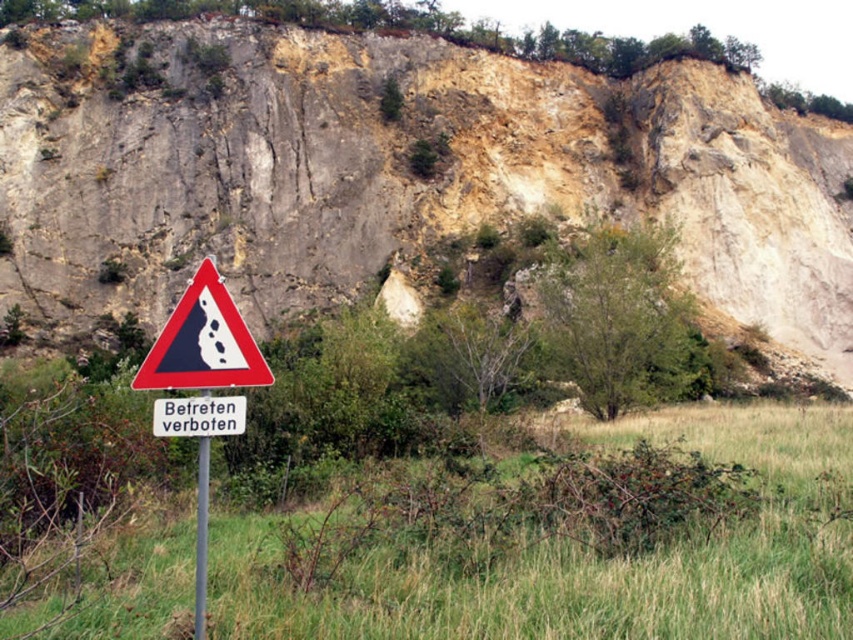
Does rough stone cliff at upper center have a lesser height compared to red triangle warning sign at lower left?

In fact, rough stone cliff at upper center may be taller than red triangle warning sign at lower left.

Between rough stone cliff at upper center and red triangle warning sign at lower left, which one appears on the left side from the viewer's perspective?

From the viewer's perspective, red triangle warning sign at lower left appears more on the left side.

Does point (813, 349) lie behind point (238, 317)?

Yes, it is behind point (238, 317).

I want to click on rough stone cliff at upper center, so click(x=399, y=173).

Is the position of black glossy triangle at center more distant than that of brushed metal pole at lower center?

Yes.

Does point (200, 314) lie behind point (196, 536)?

That is False.

The image size is (853, 640). I want to click on black glossy triangle at center, so click(202, 342).

Who is positioned more to the right, white plastic sign at center or brushed metal pole at lower center?

Positioned to the right is white plastic sign at center.

Consider the image. Is white plastic sign at center below brushed metal pole at lower center?

Incorrect, white plastic sign at center is not positioned below brushed metal pole at lower center.

Who is more distant from viewer, (167, 420) or (202, 456)?

Point (167, 420)

The height and width of the screenshot is (640, 853). I want to click on white plastic sign at center, so click(x=199, y=417).